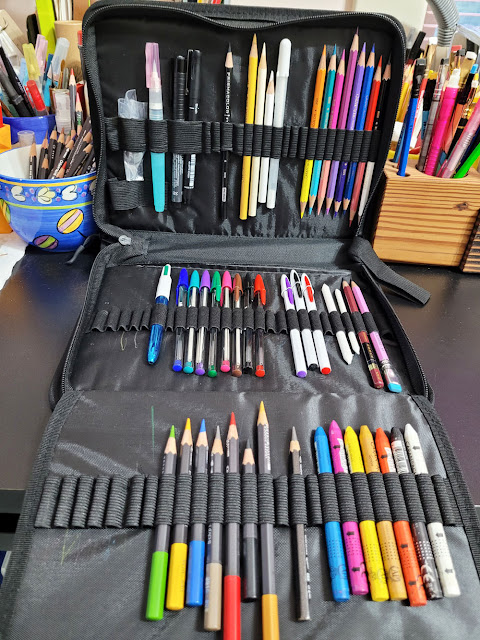
You are a GUI agent. You are given a task and a screenshot of the screen. Output one action in this format:
    pyautogui.click(x=<x>, y=<y>)
    Task: Click on the blinds in the background at the top right of the photo
    The height and width of the screenshot is (640, 480).
    Given the screenshot: What is the action you would take?
    pyautogui.click(x=474, y=10)